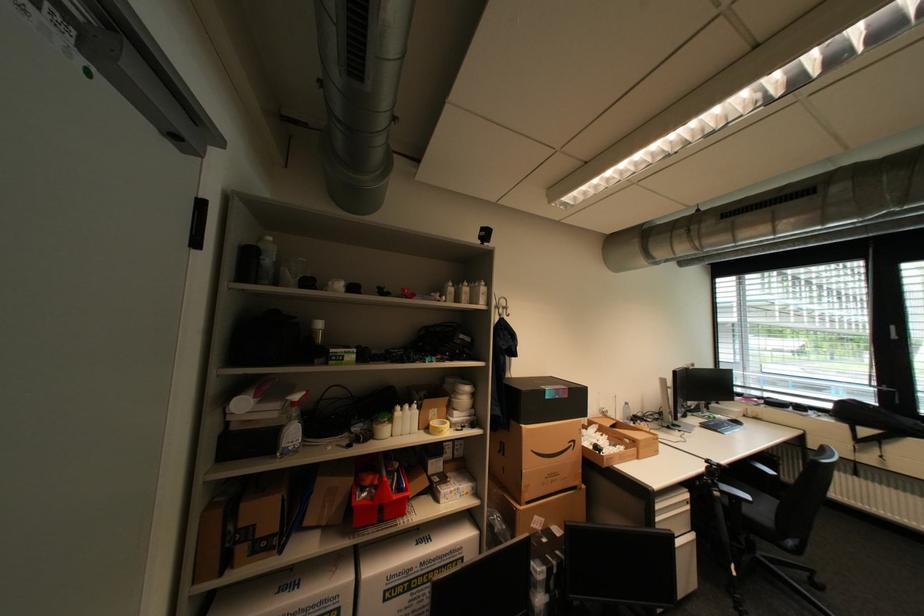
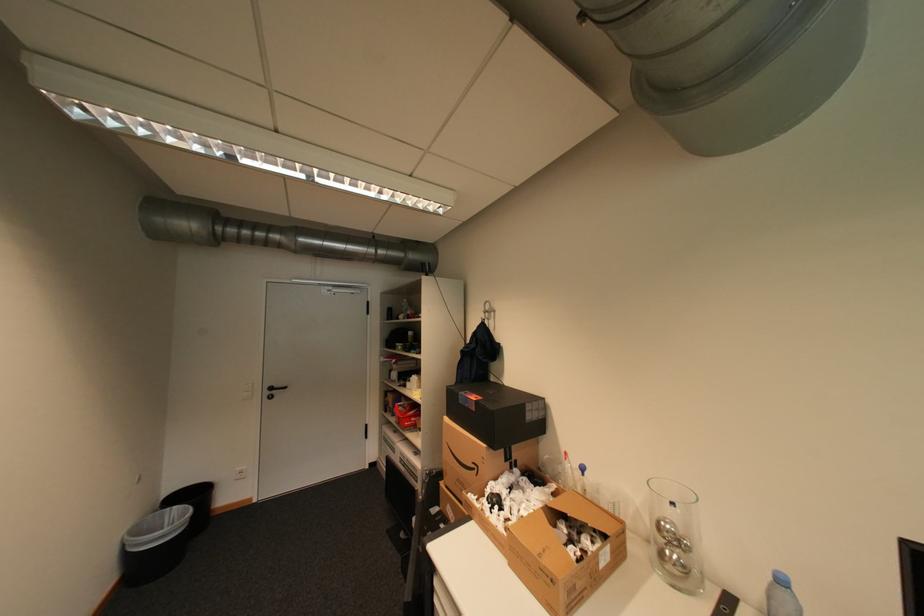
Where in the second image is the point corresponding to (x=580, y=444) from the first image?

(484, 468)